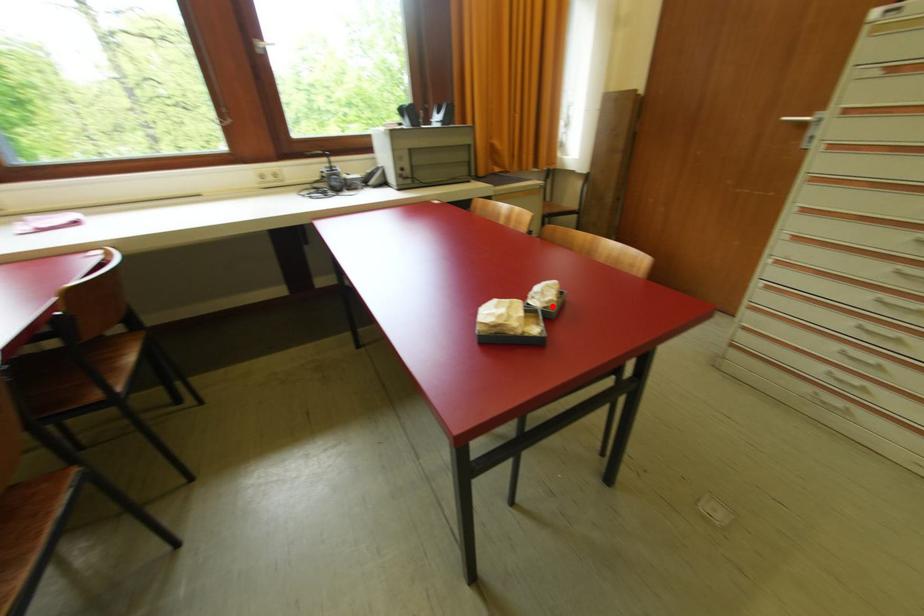
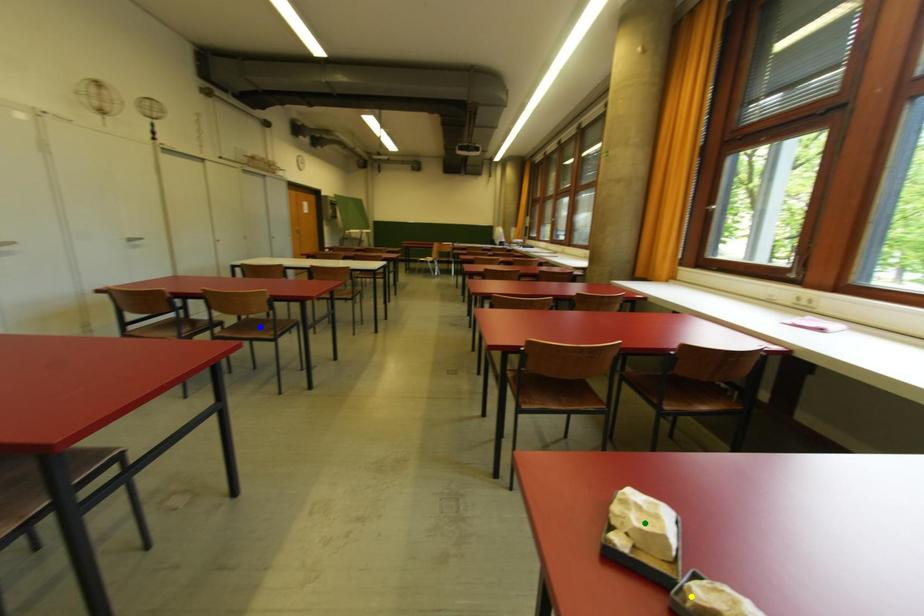
Question: I am providing you with two images of the same scene from different viewpoints. A red point is marked on the first image. You are given multiple points on the second image. Which spot in image 2 lines up with the point in image 1?

Choices:
 (A) blue point
 (B) yellow point
 (C) green point

Answer: (B)